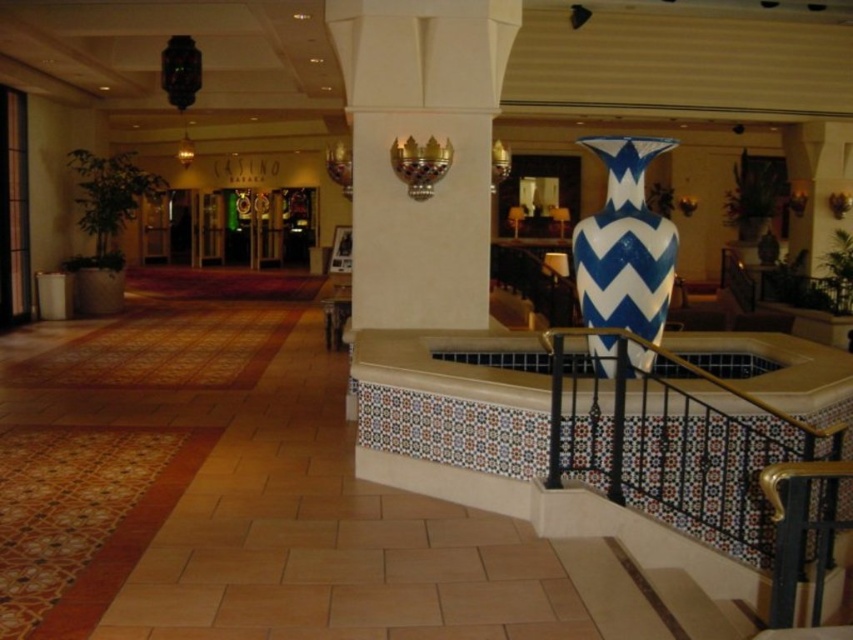
You are standing at point (363, 307) and want to walk to the fountain in the foreground. Which direction should you move relative to point (618, 484)?

Since point (618, 484) is in front of point (363, 307), you should move towards point (618, 484) to reach the fountain in the foreground.

You are standing in the luxurious hotel lobby and want to approach the fountain. There is a black metal railing at upper right. From your current position, which direction should you move to reach the fountain?

The black metal railing at upper right is located at point (698, 454), so to reach the fountain, you should move towards the lower left direction away from the railing.

You are standing at the entrance of the lobby and want to approach the fountain. There is a black metal railing at upper right located at point (698,454). Can you walk directly towards the fountain from your current position without encountering any obstacles?

Yes, you can walk directly towards the fountain from your current position because the black metal railing at upper right is located at point (698,454), which is positioned at the upper right area and not directly in your path towards the fountain.